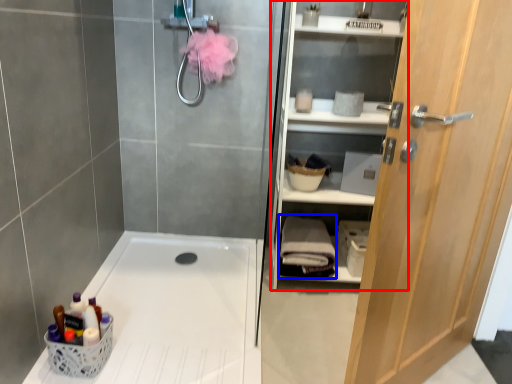
Question: Among these objects, which one is nearest to the camera, shelf (highlighted by a red box) or bath towel (highlighted by a blue box)?

Choices:
 (A) shelf
 (B) bath towel

Answer: (A)